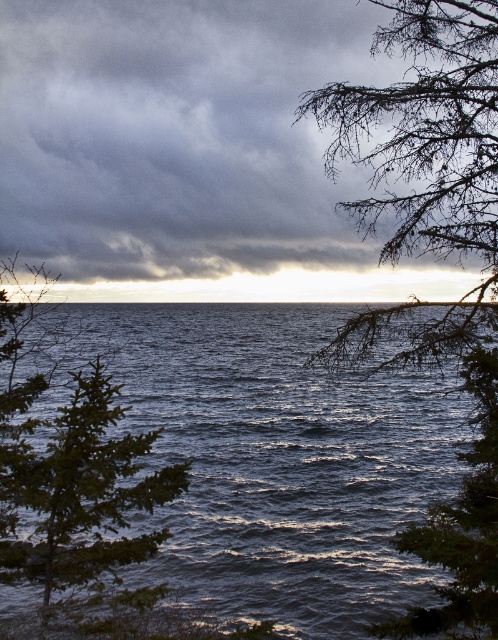
You are standing on a cliff overlooking the sea and see the dark gray cloud at upper center. If you want to take a photo of it with your camera, will you be able to capture it in full frame without zooming in?

The dark gray cloud at upper center is 11.23 meters away from the camera. Since it is within the typical focusing range of most cameras, you can capture it in full frame without needing to zoom in.

You are standing at the point with coordinates point (67, 531) and want to look towards the point with coordinates point (481, 502). In which direction should you turn your head?

You should turn your head to the left because point (481, 502) is to the left of point (67, 531).

Consider the image. You are a bird soaring above the seascape. You notice the dark gray cloud at upper center and the green textured branches at upper right. Which object is positioned to the left when observing from your aerial view?

The dark gray cloud at upper center is positioned to the left of the green textured branches at upper right.